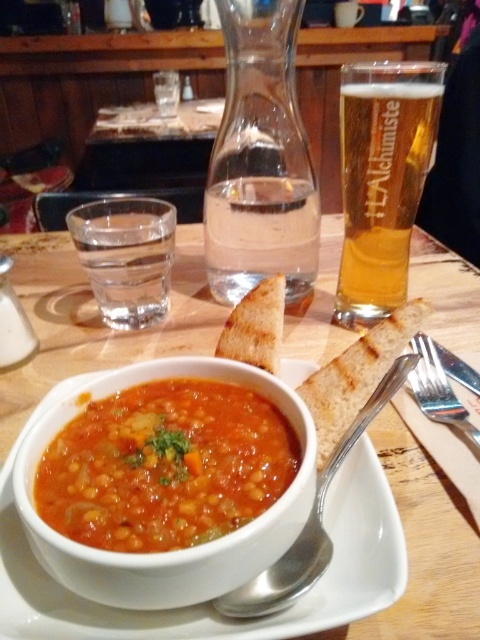
Question: Can you confirm if amber glass beer at upper right is positioned below golden brown toasted bread at center?

Choices:
 (A) yes
 (B) no

Answer: (B)

Question: Based on their relative distances, which object is nearer to the white ceramic bowl at center?

Choices:
 (A) tomato soup at center
 (B) satin silver fork at lower right
 (C) amber glass beer at upper right
 (D) silver spoon at center

Answer: (C)

Question: Which of the following is the farthest from the observer?

Choices:
 (A) (414, 502)
 (B) (419, 346)
 (C) (36, 502)
 (D) (350, 269)

Answer: (D)

Question: Is white ceramic bowl at center in front of silver spoon at center?

Choices:
 (A) yes
 (B) no

Answer: (A)

Question: Which object appears closest to the camera in this image?

Choices:
 (A) satin silver fork at lower right
 (B) golden brown toasted bread at center
 (C) silver spoon at center
 (D) amber glass beer at upper right

Answer: (C)

Question: Is amber glass beer at upper right bigger than satin silver fork at lower right?

Choices:
 (A) yes
 (B) no

Answer: (A)